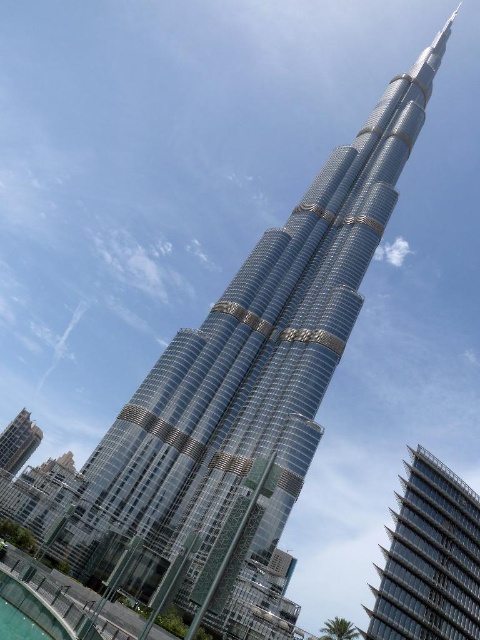
Question: Can you confirm if glassy metallic skyscraper at right is positioned to the right of clear glass pool at lower left?

Choices:
 (A) no
 (B) yes

Answer: (B)

Question: Among these points, which one is farthest from the camera?

Choices:
 (A) 34,609
 (B) 408,564
 (C) 15,458

Answer: (C)

Question: Can you confirm if glassy metallic skyscraper at right is thinner than clear glass pool at lower left?

Choices:
 (A) yes
 (B) no

Answer: (B)

Question: Can you confirm if clear glass pool at lower left is wider than glassy metallic building at lower left?

Choices:
 (A) yes
 (B) no

Answer: (B)

Question: Among these objects, which one is nearest to the camera?

Choices:
 (A) clear glass pool at lower left
 (B) glassy metallic building at lower left
 (C) glassy metallic skyscraper at right

Answer: (A)

Question: Which object is the closest to the clear glass pool at lower left?

Choices:
 (A) glassy metallic skyscraper at right
 (B) glassy metallic building at lower left

Answer: (A)